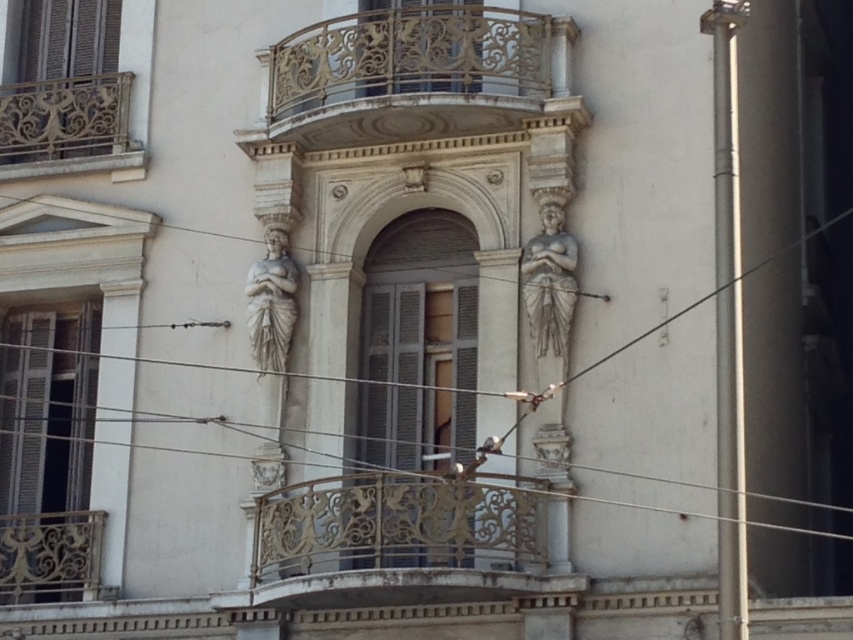
You are an architect assessing the symmetry of the building facade. You observe the gold ornate railing at upper center and the gold ornate railing at upper left. Which of these two railings has a smaller width?

The gold ornate railing at upper center has a lesser width compared to the gold ornate railing at upper left, so the gold ornate railing at upper center is the smaller one in width.

You are an architect designing a new building and want to ensure there is enough space between the gold ornate railing at upper left and the gray stone statue at center for a 10 meter long decorative banner to hang between them. Based on the scene, will the banner fit?

The distance between the gold ornate railing at upper left and the gray stone statue at center is 9.81 meters, which is slightly less than the 10 meter length of the banner. Therefore, the banner will not fit between them.

You are standing in front of the classical building and want to take a photo of the gray stone statue at center. To avoid including the gold ornate railing at upper left in your photo, should you move to the left or the right of the statue?

You should move to the right of the gray stone statue at center because the gold ornate railing at upper left is located to the left of it, so moving right would position the railing out of the frame.